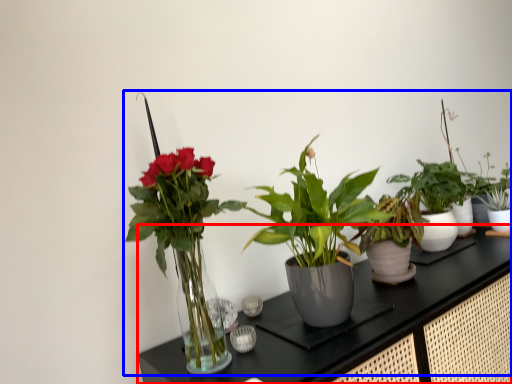
Question: Which of the following is the closest to the observer, counter (highlighted by a red box) or houseplant (highlighted by a blue box)?

Choices:
 (A) counter
 (B) houseplant

Answer: (A)